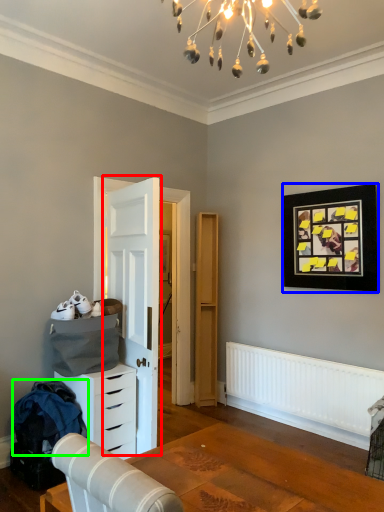
Question: Which object is the closest to the door (highlighted by a red box)? Choose among these: picture frame (highlighted by a blue box) or laundry (highlighted by a green box).

Choices:
 (A) picture frame
 (B) laundry

Answer: (B)